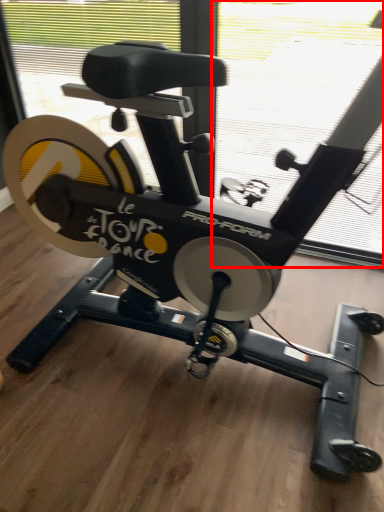
Question: Where is window screen (annotated by the red box) located in relation to window screen in the image?

Choices:
 (A) right
 (B) left

Answer: (A)